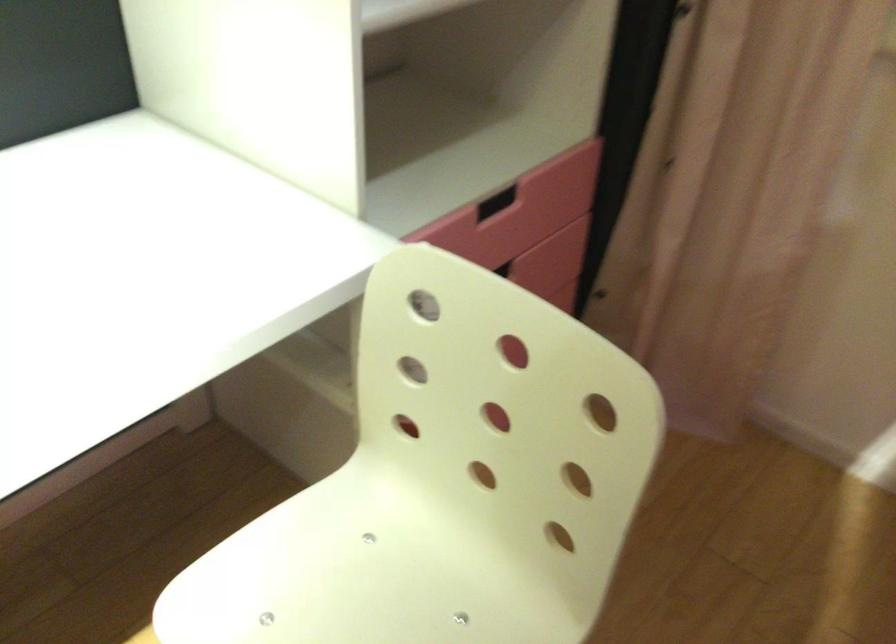
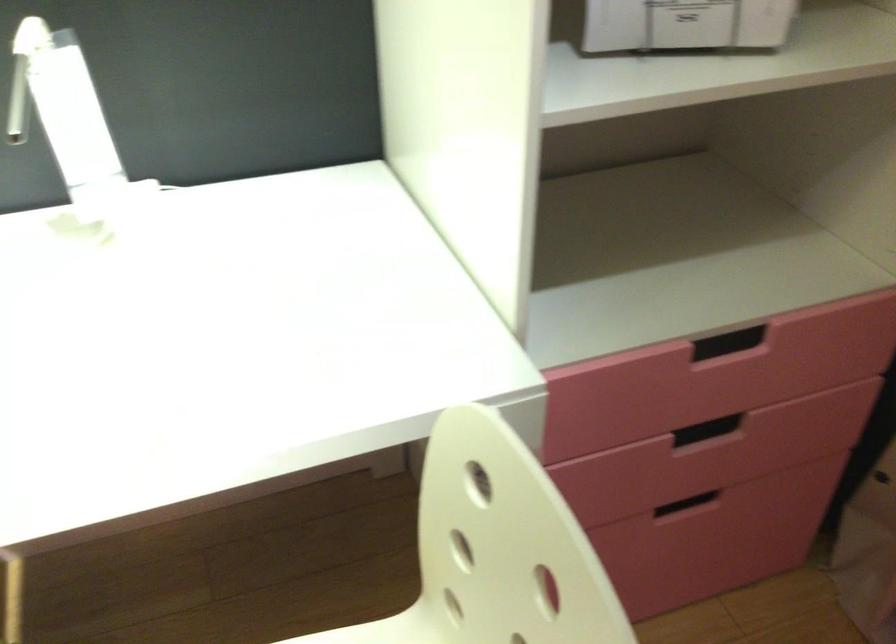
What movement of the cameraman would produce the second image?

The movement direction of the cameraman is right, forward.